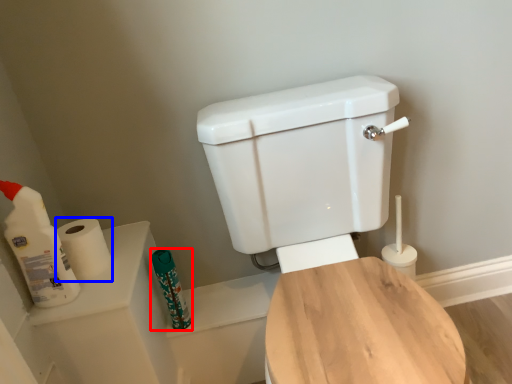
Question: Which point is further to the camera, toiletry (highlighted by a red box) or toilet paper (highlighted by a blue box)?

Choices:
 (A) toiletry
 (B) toilet paper

Answer: (A)